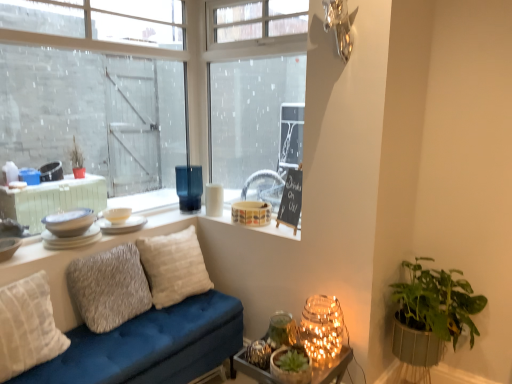
Question: Which direction should I rotate to look at translucent glass vase at window, placed as the 1th candle holder when sorted from left to right?

Choices:
 (A) right
 (B) left

Answer: (B)

Question: Considering the relative positions of textured gray pillow at center, positioned as the 2th pillow in front-to-back order, and white glossy bowls at upper left, which appears as the 2th tableware when viewed from the front, in the image provided, is textured gray pillow at center, positioned as the 2th pillow in front-to-back order, to the right of white glossy bowls at upper left, which appears as the 2th tableware when viewed from the front, from the viewer's perspective?

Choices:
 (A) no
 (B) yes

Answer: (B)

Question: From a real-world perspective, is textured gray pillow at center, positioned as the 2th pillow in front-to-back order, physically below white glossy bowls at upper left, which appears as the 2th tableware when viewed from the front?

Choices:
 (A) yes
 (B) no

Answer: (A)

Question: From the image's perspective, does textured gray pillow at center, marked as the 2th pillow in a back-to-front arrangement, appear lower than white glossy bowls at upper left, the 3th tableware positioned from the back?

Choices:
 (A) no
 (B) yes

Answer: (B)

Question: Can you confirm if textured gray pillow at center, marked as the 2th pillow in a back-to-front arrangement, is thinner than white glossy bowls at upper left, which appears as the 2th tableware when viewed from the front?

Choices:
 (A) yes
 (B) no

Answer: (A)

Question: Is the surface of textured gray pillow at center, marked as the 2th pillow in a back-to-front arrangement, in direct contact with white glossy bowls at upper left, which appears as the 2th tableware when viewed from the front?

Choices:
 (A) yes
 (B) no

Answer: (B)

Question: Is textured gray pillow at center, positioned as the 2th pillow in front-to-back order, completely or partially outside of white glossy bowls at upper left, the 3th tableware positioned from the back?

Choices:
 (A) no
 (B) yes

Answer: (B)

Question: Is white matte candle holder at upper center, marked as the 2th candle holder in a right-to-left arrangement, thinner than matte white plate at upper left, which appears as the third tableware when viewed from the front?

Choices:
 (A) yes
 (B) no

Answer: (A)

Question: Does white matte candle holder at upper center, the second candle holder positioned from the left, have a lesser height compared to matte white plate at upper left, the second tableware viewed from the back?

Choices:
 (A) yes
 (B) no

Answer: (B)

Question: Is white matte candle holder at upper center, marked as the 2th candle holder in a right-to-left arrangement, not inside matte white plate at upper left, which appears as the third tableware when viewed from the front?

Choices:
 (A) yes
 (B) no

Answer: (A)

Question: From a real-world perspective, is white matte candle holder at upper center, the second candle holder positioned from the left, on top of matte white plate at upper left, the second tableware viewed from the back?

Choices:
 (A) yes
 (B) no

Answer: (A)

Question: Would you consider white matte candle holder at upper center, the second candle holder positioned from the left, to be distant from matte white plate at upper left, the second tableware viewed from the back?

Choices:
 (A) yes
 (B) no

Answer: (B)

Question: Considering the relative sizes of white matte candle holder at upper center, marked as the 2th candle holder in a right-to-left arrangement, and matte white plate at upper left, which appears as the third tableware when viewed from the front, in the image provided, is white matte candle holder at upper center, marked as the 2th candle holder in a right-to-left arrangement, smaller than matte white plate at upper left, which appears as the third tableware when viewed from the front,?

Choices:
 (A) yes
 (B) no

Answer: (A)

Question: Is matte ceramic bowl at upper center, positioned as the 1th candle holder in right-to-left order, located outside green textured pot at lower right, positioned as the first houseplant in left-to-right order?

Choices:
 (A) no
 (B) yes

Answer: (B)